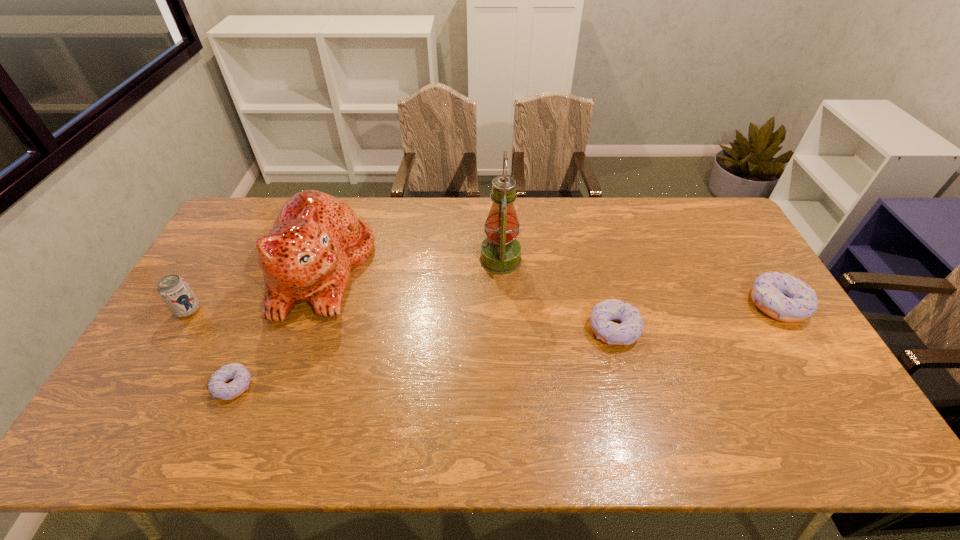
Locate an element on the screen. The image size is (960, 540). vacant space situated 0.270m on the back of the nearest doughnut is located at coordinates (274, 294).

At what (x,y) coordinates should I click in order to perform the action: click on free location located 0.080m on the back of the second shortest doughnut. Please return your answer as a coordinate pair (x, y). Image resolution: width=960 pixels, height=540 pixels. Looking at the image, I should click on (603, 290).

At what (x,y) coordinates should I click in order to perform the action: click on vacant space located 0.140m on the left of the rightmost object. Please return your answer as a coordinate pair (x, y). Image resolution: width=960 pixels, height=540 pixels. Looking at the image, I should click on (702, 305).

The height and width of the screenshot is (540, 960). I want to click on vacant area situated on the face of the second tallest object, so click(x=482, y=269).

Locate an element on the screen. Image resolution: width=960 pixels, height=540 pixels. vacant space situated 0.260m on the left of the tallest object is located at coordinates (400, 260).

Identify the location of free space located 0.090m on the front of the third tallest object. Image resolution: width=960 pixels, height=540 pixels. (168, 345).

At what (x,y) coordinates should I click in order to perform the action: click on object that is at the far edge. Please return your answer as a coordinate pair (x, y). The height and width of the screenshot is (540, 960). Looking at the image, I should click on (316, 240).

The height and width of the screenshot is (540, 960). I want to click on object located in the near edge section of the desktop, so click(x=217, y=386).

The width and height of the screenshot is (960, 540). What are the coordinates of `object that is at the left edge` in the screenshot? It's located at (173, 289).

This screenshot has height=540, width=960. What are the coordinates of `object at the right edge` in the screenshot? It's located at (786, 298).